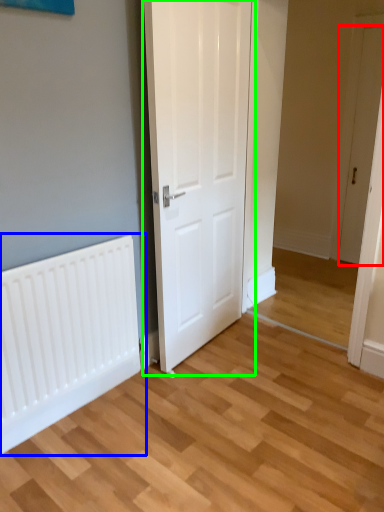
Question: Which object is the farthest from door (highlighted by a red box)? Choose among these: radiator (highlighted by a blue box) or door (highlighted by a green box).

Choices:
 (A) radiator
 (B) door

Answer: (A)